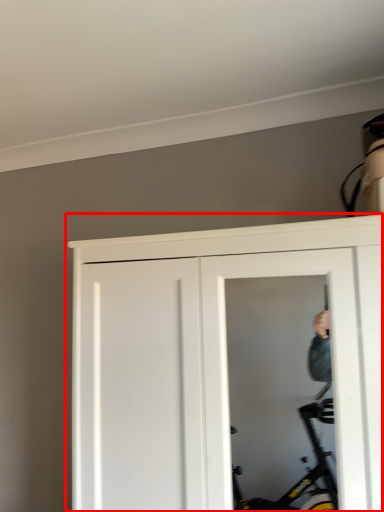
Question: Where is door (annotated by the red box) located in relation to screen door in the image?

Choices:
 (A) right
 (B) left

Answer: (B)